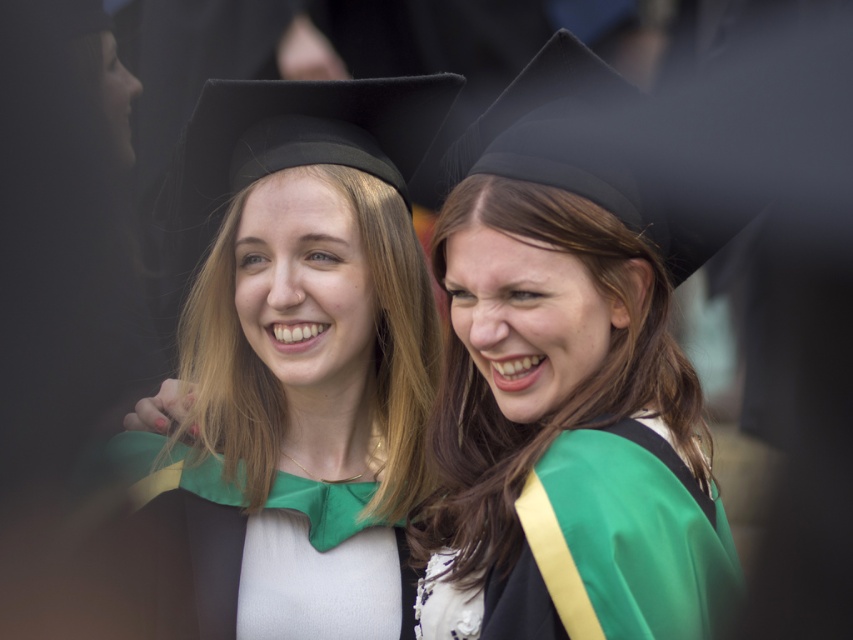
In the scene shown: Does matte black graduation cap at center have a greater height compared to green satin gown at center?

Indeed, matte black graduation cap at center has a greater height compared to green satin gown at center.

Is point (270, 161) farther from viewer compared to point (482, 595)?

That is True.

Find the location of `matte black graduation cap at center`. matte black graduation cap at center is located at coordinates (300, 356).

Which of these two, green satin graduation gown at center or matte black graduation cap at center, stands shorter?

green satin graduation gown at center

Does green satin graduation gown at center appear under matte black graduation cap at center?

Indeed, green satin graduation gown at center is positioned under matte black graduation cap at center.

The width and height of the screenshot is (853, 640). Find the location of `green satin graduation gown at center`. green satin graduation gown at center is located at coordinates (566, 396).

Does green satin graduation gown at center have a smaller size compared to green satin gown at center?

Actually, green satin graduation gown at center might be larger than green satin gown at center.

This screenshot has width=853, height=640. In order to click on green satin graduation gown at center in this screenshot , I will do `click(566, 396)`.

You are a GUI agent. You are given a task and a screenshot of the screen. Output one action in this format:
    pyautogui.click(x=<x>, y=<y>)
    Task: Click on the green satin graduation gown at center
    The width and height of the screenshot is (853, 640).
    Given the screenshot: What is the action you would take?
    pyautogui.click(x=566, y=396)